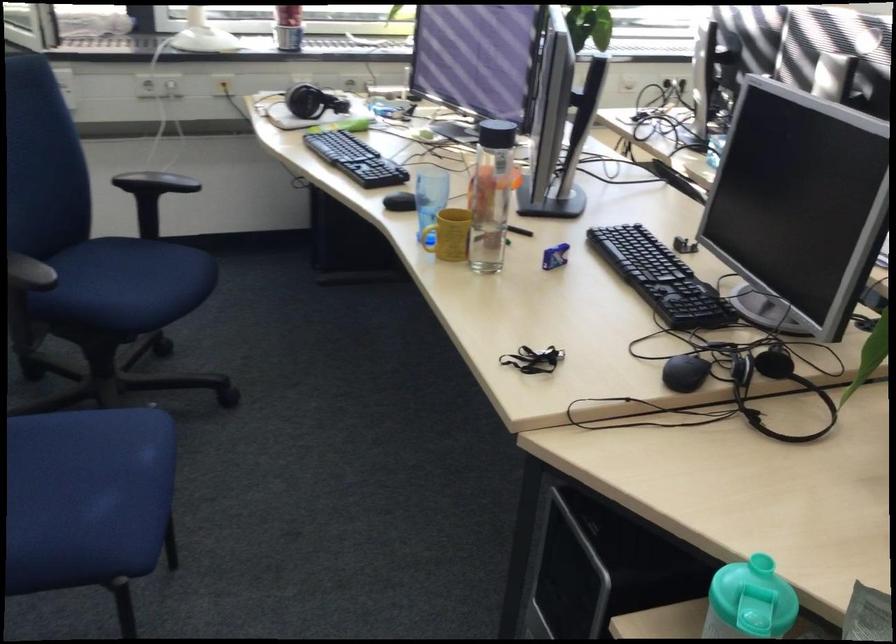
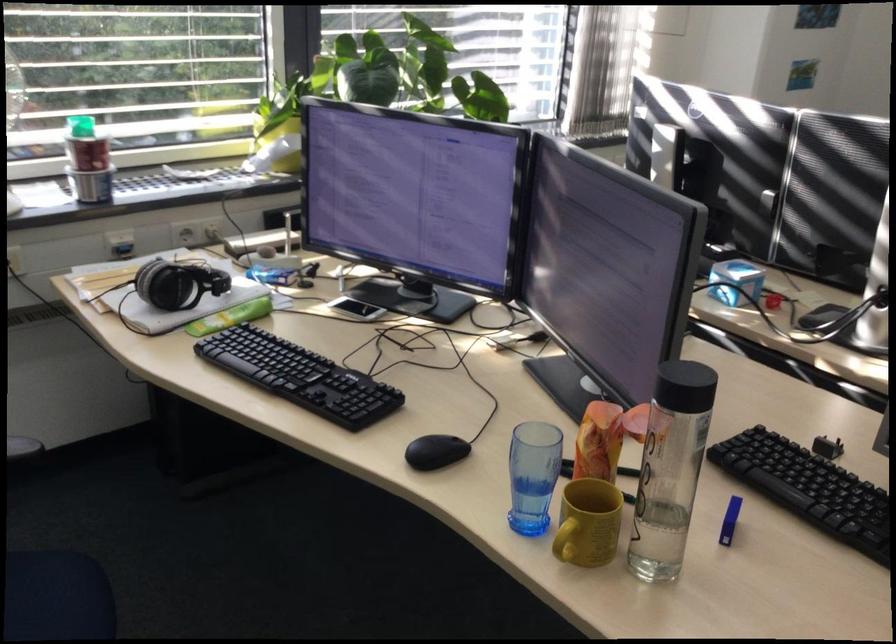
Where in the second image is the point corresponding to the point at 550,251 from the first image?

(729, 520)